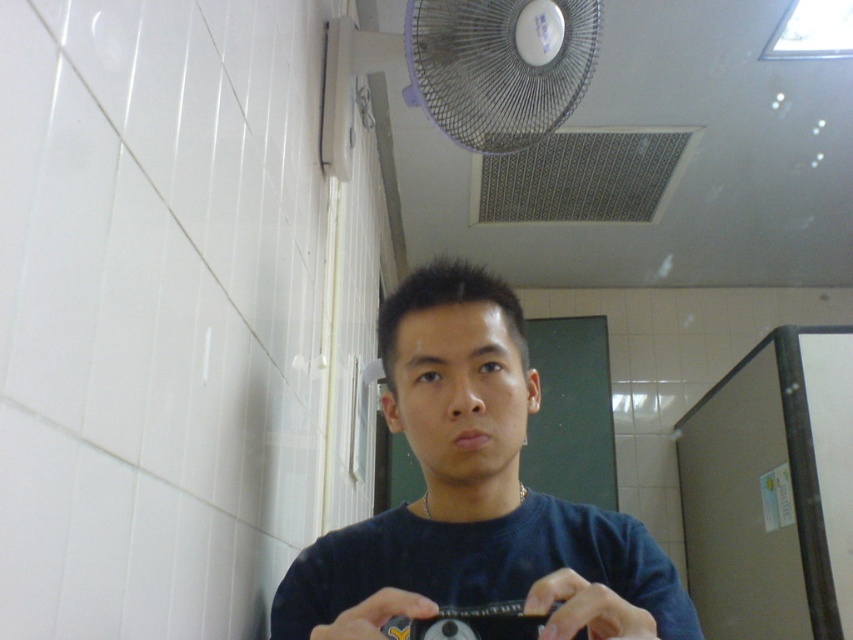
Does dark blue t-shirt at center come in front of black plastic camera at center?

Yes.

Is dark blue t-shirt at center smaller than black plastic camera at center?

Actually, dark blue t-shirt at center might be larger than black plastic camera at center.

The width and height of the screenshot is (853, 640). I want to click on dark blue t-shirt at center, so click(x=474, y=493).

Does dark blue t-shirt at center appear on the left side of white plastic fan at upper center?

Indeed, dark blue t-shirt at center is positioned on the left side of white plastic fan at upper center.

Between point (473, 544) and point (543, 42), which one is positioned in front?

Point (473, 544) is in front.

Find the location of `dark blue t-shirt at center`. dark blue t-shirt at center is located at coordinates (474, 493).

Is white plastic fan at upper center shorter than black plastic camera at center?

No.

Between white plastic fan at upper center and black plastic camera at center, which one is positioned higher?

white plastic fan at upper center is higher up.

Image resolution: width=853 pixels, height=640 pixels. I want to click on white plastic fan at upper center, so click(498, 67).